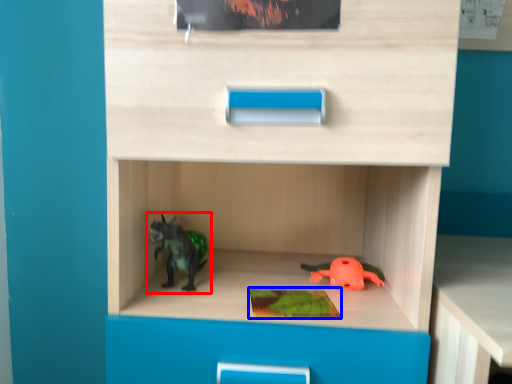
Question: Which of the following is the farthest to the observer, toy (highlighted by a red box) or paperback book (highlighted by a blue box)?

Choices:
 (A) toy
 (B) paperback book

Answer: (A)